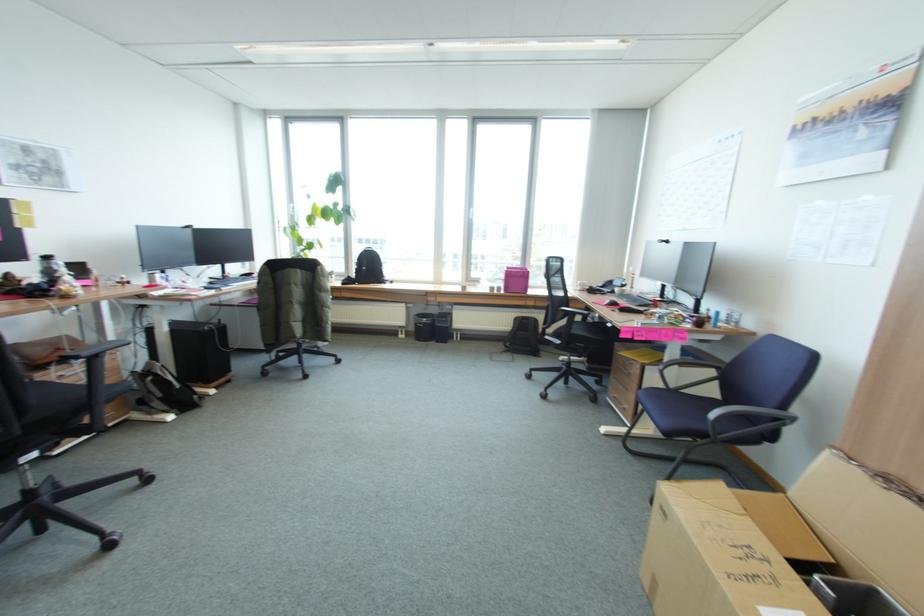
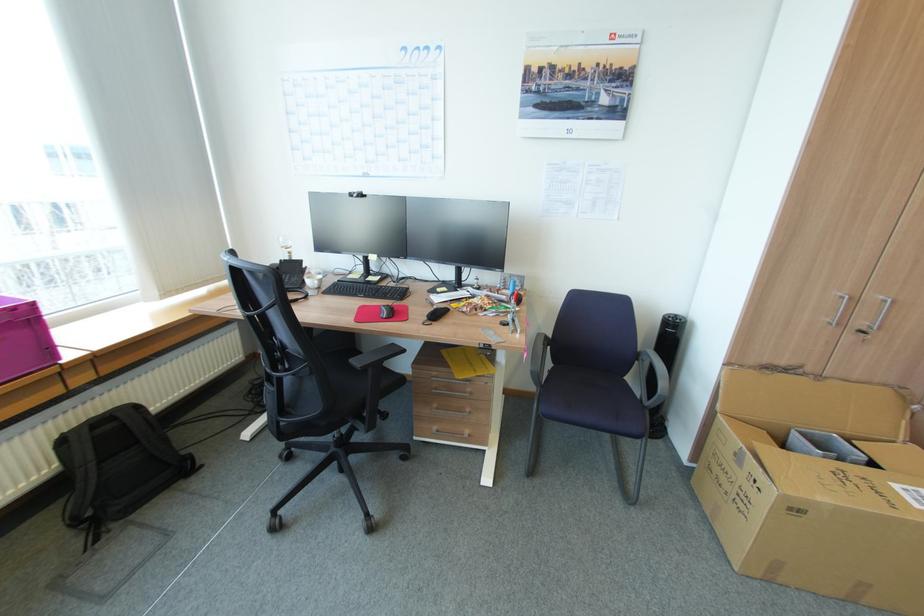
Where in the second image is the point corresponding to (641,296) from the first image?

(344, 281)